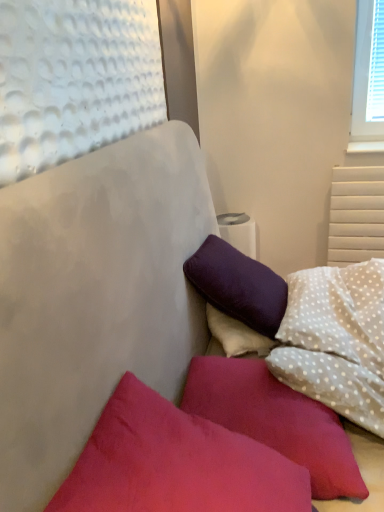
Image resolution: width=384 pixels, height=512 pixels. What are the coordinates of `blank space situated above matte pink pillow at lower left, the 2th pillow positioned from the front (from a real-world perspective)` in the screenshot? It's located at (273, 396).